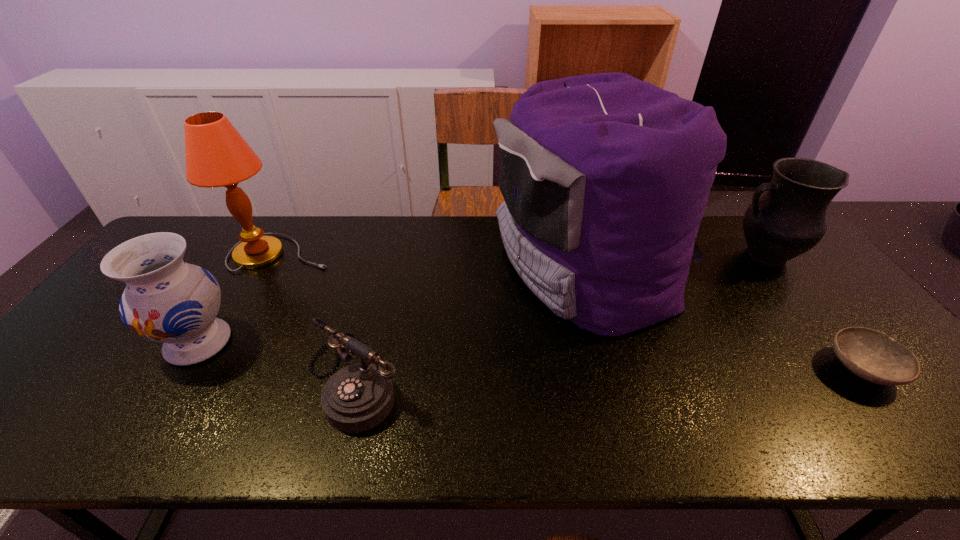
You are a GUI agent. You are given a task and a screenshot of the screen. Output one action in this format:
    pyautogui.click(x=<x>, y=<y>)
    Task: Click on the backpack
    
    Given the screenshot: What is the action you would take?
    pyautogui.click(x=605, y=177)

Locate an element on the screen. The width and height of the screenshot is (960, 540). the tallest object is located at coordinates (605, 177).

Where is `lamp`? The width and height of the screenshot is (960, 540). lamp is located at coordinates (217, 155).

The height and width of the screenshot is (540, 960). What are the coordinates of `pitcher` in the screenshot? It's located at (788, 220).

Image resolution: width=960 pixels, height=540 pixels. Identify the location of vase. (167, 300).

Find the location of a particular element. This screenshot has height=540, width=960. telephone is located at coordinates pyautogui.click(x=358, y=397).

Locate an element on the screen. This screenshot has width=960, height=540. the third object from left to right is located at coordinates (358, 397).

Identify the location of the shortest object. (874, 356).

I want to click on free spot located 0.150m on the front pocket of the tallest object, so click(442, 268).

The width and height of the screenshot is (960, 540). I want to click on vacant space located 0.130m on the front pocket of the tallest object, so click(x=448, y=268).